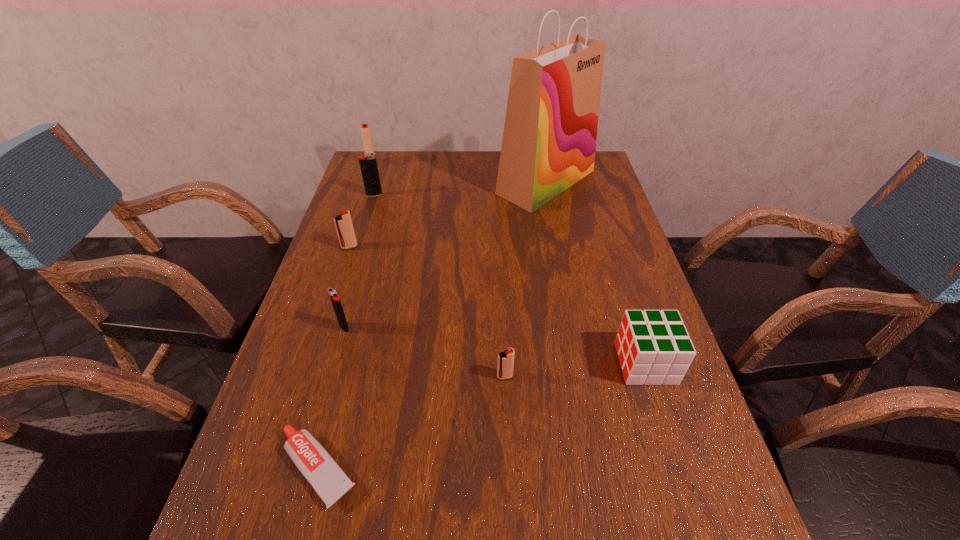
At what (x,y) coordinates should I click in order to perform the action: click on object that is at the far right corner. Please return your answer as a coordinate pair (x, y). This screenshot has height=540, width=960. Looking at the image, I should click on (549, 141).

In the image, there is a desktop. Identify the location of free space at the left edge. (315, 397).

You are a GUI agent. You are given a task and a screenshot of the screen. Output one action in this format:
    pyautogui.click(x=<x>, y=<y>)
    Task: Click on the vacant space at the right edge of the desktop
    The width and height of the screenshot is (960, 540).
    Given the screenshot: What is the action you would take?
    pyautogui.click(x=680, y=479)

Find the location of a particular element. This screenshot has width=960, height=540. empty space between the rightmost igniter and the cube is located at coordinates (575, 370).

I want to click on free space between the seventh tallest object and the fourth nearest igniter, so click(440, 286).

This screenshot has width=960, height=540. I want to click on free spot between the bigger black igniter and the nearer black igniter, so click(x=359, y=261).

Locate an element on the screen. The image size is (960, 540). empty space between the third farthest igniter and the rightmost igniter is located at coordinates (427, 312).

You are a GUI agent. You are given a task and a screenshot of the screen. Output one action in this format:
    pyautogui.click(x=<x>, y=<y>)
    Task: Click on the unoccupied position between the fifth farthest object and the rightmost igniter
    This screenshot has width=960, height=540.
    Given the screenshot: What is the action you would take?
    pyautogui.click(x=424, y=352)

Where is `vacant area that lies between the shortest igniter and the nearest object`? vacant area that lies between the shortest igniter and the nearest object is located at coordinates (412, 422).

The height and width of the screenshot is (540, 960). I want to click on unoccupied area between the tallest object and the smaller black igniter, so click(445, 255).